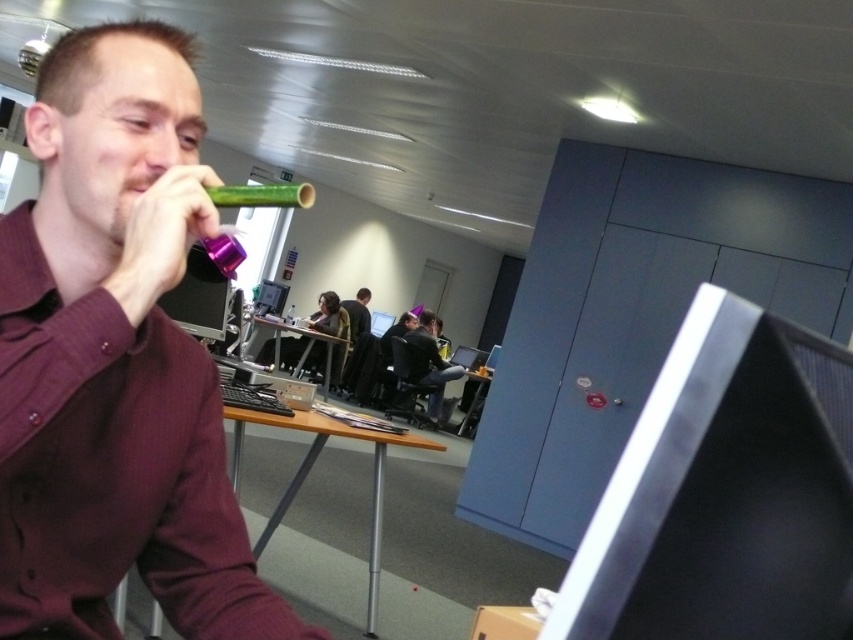
You are an office worker standing at the wooden desk at center. You want to grab the matte green horn at center to blow a celebratory note. Can you reach it without moving from your current position?

The matte green horn at center is to the right of wooden desk at center, so you can reach it without moving from your current position since it is within arm reach to the right.

You are an office assistant who needs to place a new matte green horn at center and a matte black shirt at center in the office. Given their sizes, which object should be placed in a smaller storage space?

The matte green horn at center has a smaller size compared to the matte black shirt at center, so the matte green horn at center should be placed in the smaller storage space.

You are standing in the office and want to pick up the dark gray sweater at center. Where should you walk to in the room?

You should walk to point (x=430, y=365) to pick up the dark gray sweater at center.